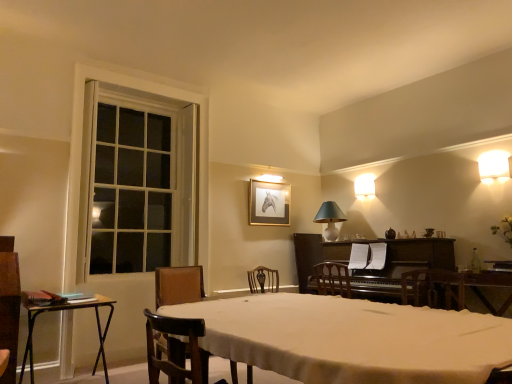
Locate an element on the screen. The width and height of the screenshot is (512, 384). blank space situated above white glossy wall sconce at upper right, which appears as the first lamp when viewed from the right (from a real-world perspective) is located at coordinates (490, 162).